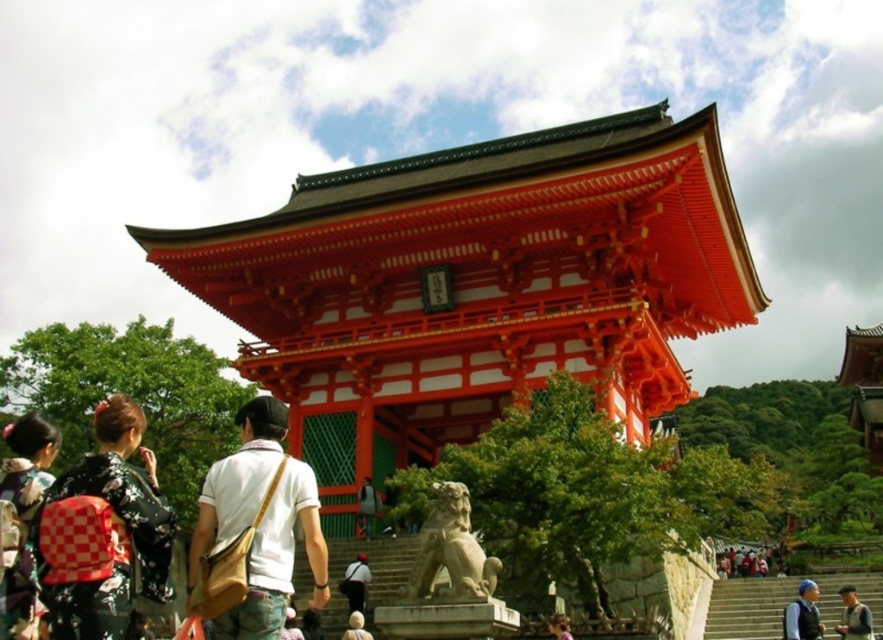
You are a photographer standing in front of the traditional Japanese temple structure. You notice the checkered fabric kimono at lower left and the gray fabric jacket at lower right. Which clothing item is covering the other one?

The checkered fabric kimono at lower left is positioned over the gray fabric jacket at lower right, so it is covering the jacket.

You are a photographer planning to capture the shiny lacquered pagoda at center and the blue fabric headscarf at lower right in a single frame. Based on their sizes, which object should you focus on to ensure both are clearly visible without cropping?

The shiny lacquered pagoda at center is wider than the blue fabric headscarf at lower right, so you should focus on the shiny lacquered pagoda at center to ensure both are visible without cropping.

You are standing at the entrance of the temple and want to take a photo of the shiny lacquered pagoda at center. If your camera can focus up to 40 meters, will you be able to capture it clearly?

The shiny lacquered pagoda at center is 42.85 meters from the camera, which is beyond the camera focus limit of 40 meters. Therefore, the pagoda will not be captured clearly.